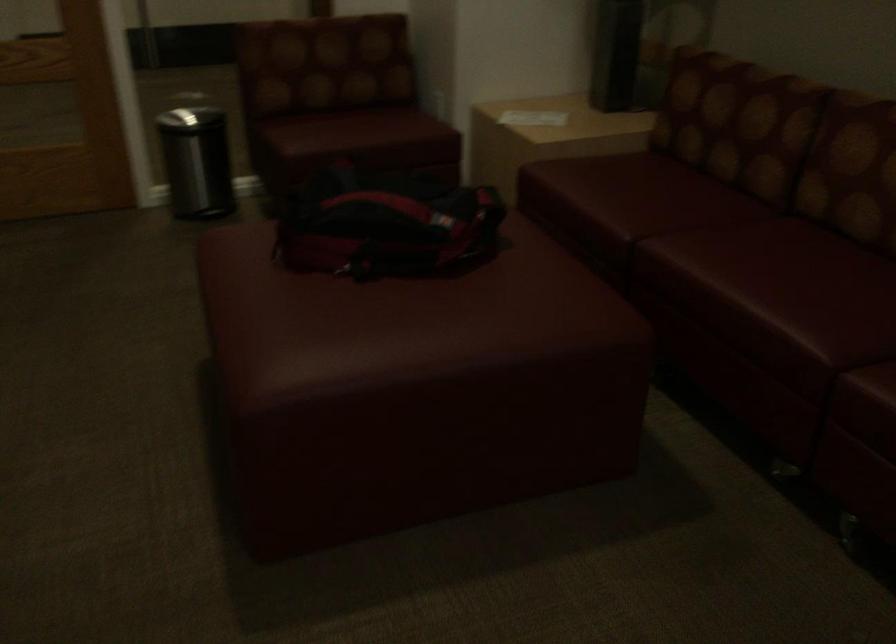
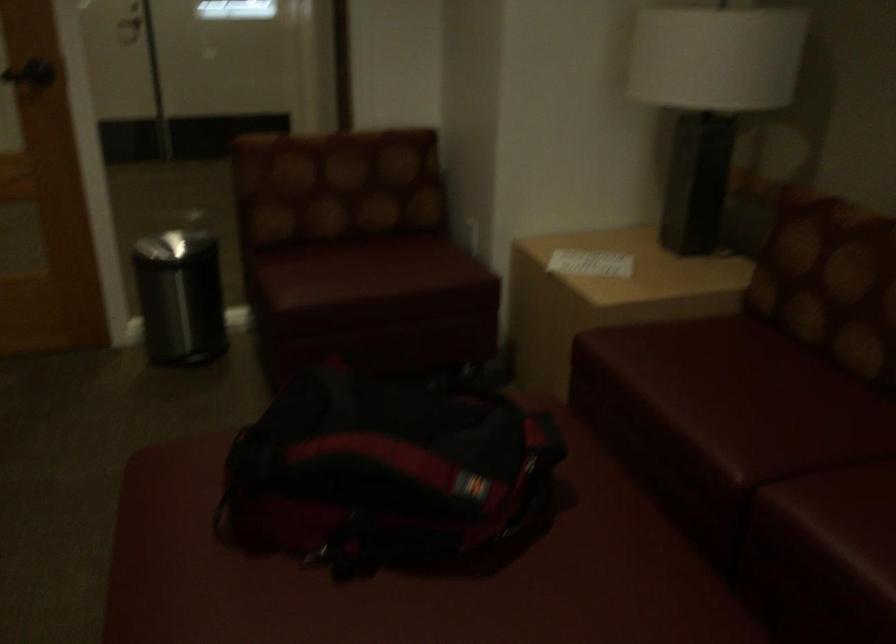
Locate, in the second image, the point that corresponds to point (194, 154) in the first image.

(179, 297)